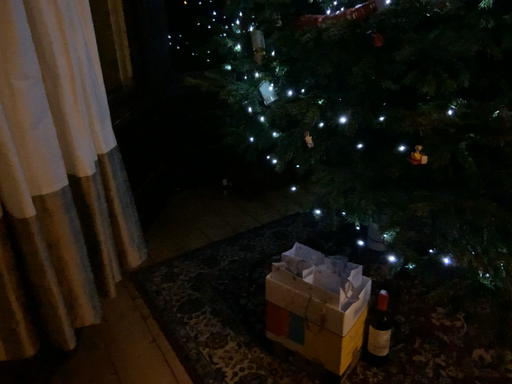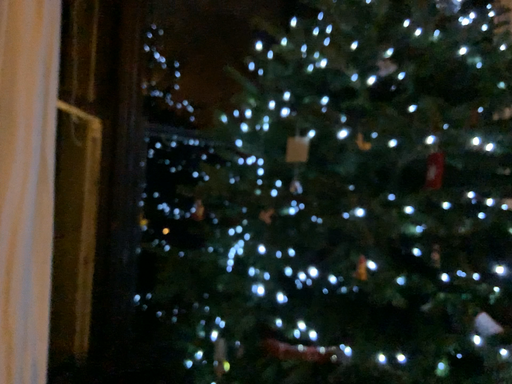
Question: Which way did the camera rotate in the video?

Choices:
 (A) rotated upward
 (B) rotated downward

Answer: (A)